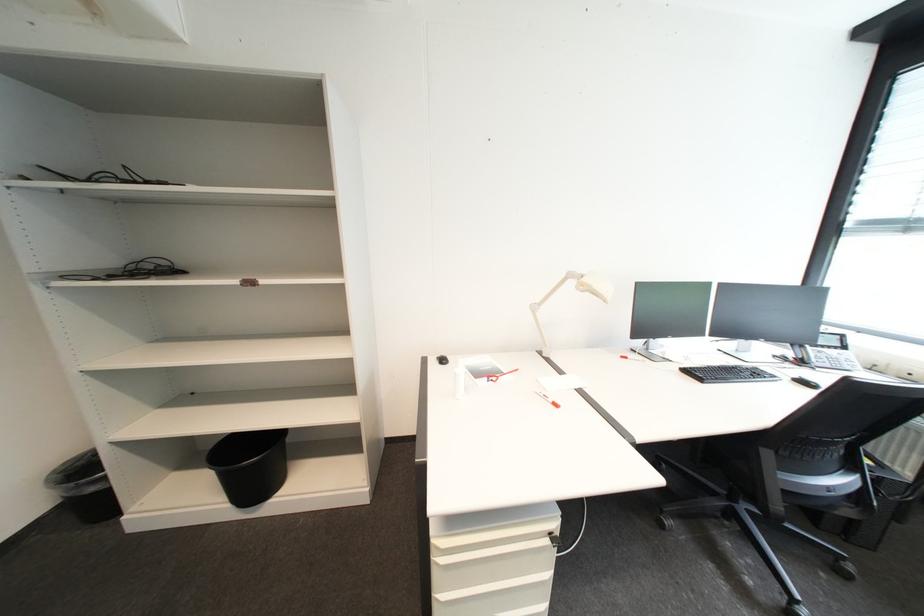
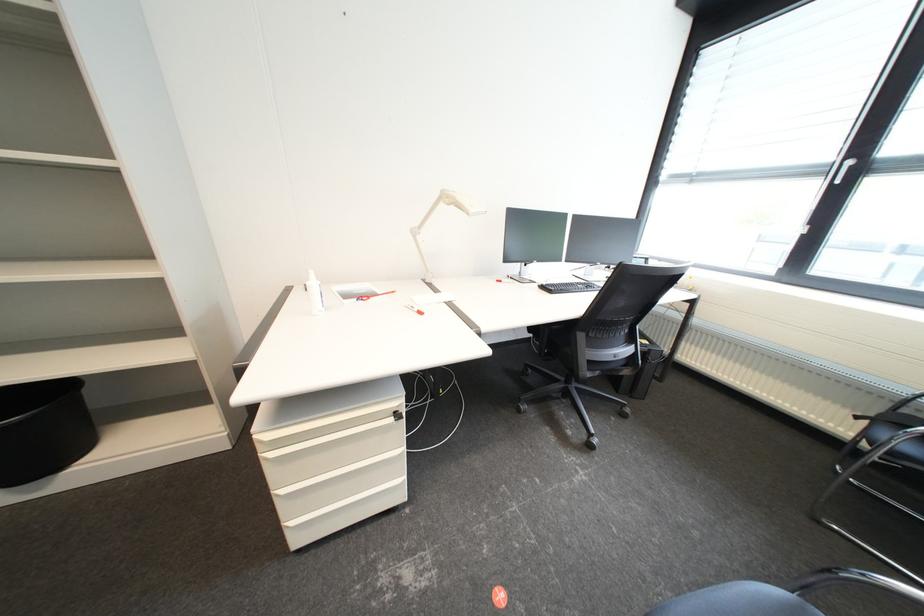
Question: Based on the continuous images, in which direction is the camera rotating? Reply with the corresponding letter.

Choices:
 (A) Left
 (B) Right
 (C) Up
 (D) Down

Answer: (B)